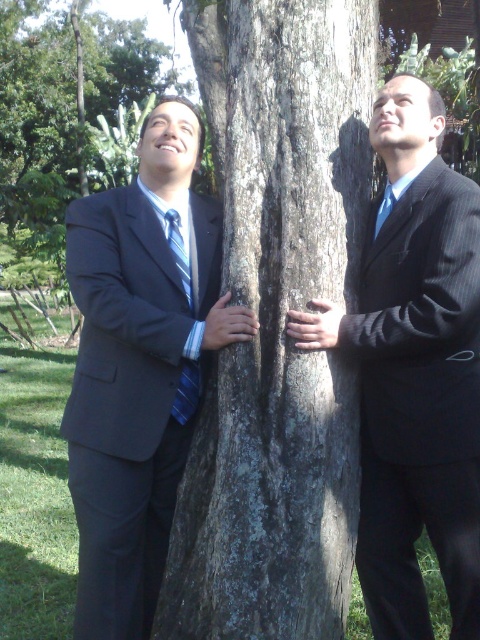
Question: Which of the following is the closest to the observer?

Choices:
 (A) (315, 328)
 (B) (90, 435)

Answer: (A)

Question: Can you confirm if dark brown textured bark at center is positioned below blue striped tie at left?

Choices:
 (A) no
 (B) yes

Answer: (A)

Question: Which object is closer to the camera taking this photo?

Choices:
 (A) blue silk tie at right
 (B) gray rough bark tree trunk at center

Answer: (B)

Question: Is gray rough bark tree trunk at center to the right of blue striped tie at left from the viewer's perspective?

Choices:
 (A) yes
 (B) no

Answer: (A)

Question: Does gray rough bark tree trunk at center come behind pinstripe suit at center?

Choices:
 (A) no
 (B) yes

Answer: (B)

Question: Which point is closer to the camera?

Choices:
 (A) blue silk tie at right
 (B) gray rough bark tree trunk at center
 (C) matte black suit at left
 (D) pinstripe suit at center

Answer: (D)